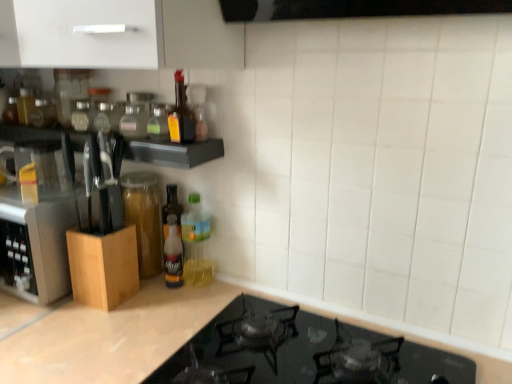
Question: From the image's perspective, is black glass stovetop at lower center located above transparent glass jar at left?

Choices:
 (A) yes
 (B) no

Answer: (B)

Question: Can you confirm if black glass stovetop at lower center is positioned to the left of transparent glass jar at left?

Choices:
 (A) no
 (B) yes

Answer: (A)

Question: Can you confirm if black glass stovetop at lower center is wider than transparent glass jar at left?

Choices:
 (A) no
 (B) yes

Answer: (B)

Question: Is black glass stovetop at lower center closer to camera compared to transparent glass jar at left?

Choices:
 (A) no
 (B) yes

Answer: (B)

Question: Can you confirm if black glass stovetop at lower center is bigger than transparent glass jar at left?

Choices:
 (A) yes
 (B) no

Answer: (A)

Question: Would you say transparent glass jar at left is inside or outside translucent plastic bottle at upper center, the 4th bottle ordered from the bottom?

Choices:
 (A) outside
 (B) inside

Answer: (A)

Question: In the image, is transparent glass jar at left positioned in front of or behind translucent plastic bottle at upper center, the third bottle when ordered from top to bottom?

Choices:
 (A) front
 (B) behind

Answer: (B)

Question: From their relative heights in the image, would you say transparent glass jar at left is taller or shorter than translucent plastic bottle at upper center, the 4th bottle ordered from the bottom?

Choices:
 (A) short
 (B) tall

Answer: (B)

Question: Is transparent glass jar at left bigger or smaller than translucent plastic bottle at upper center, the 4th bottle ordered from the bottom?

Choices:
 (A) big
 (B) small

Answer: (A)

Question: Visually, is translucent glass bottle at center, the first bottle positioned from the bottom, positioned to the left or to the right of transparent glass jar at left?

Choices:
 (A) left
 (B) right

Answer: (B)

Question: In terms of width, does translucent glass bottle at center, which is the sixth bottle in top-to-bottom order, look wider or thinner when compared to transparent glass jar at left?

Choices:
 (A) thin
 (B) wide

Answer: (A)

Question: Is point (179, 281) positioned closer to the camera than point (155, 177)?

Choices:
 (A) farther
 (B) closer

Answer: (B)

Question: From a real-world perspective, relative to transparent glass jar at left, is translucent glass bottle at center, the first bottle positioned from the bottom, vertically above or below?

Choices:
 (A) below
 (B) above

Answer: (A)

Question: Looking at the image, does transparent glass jar at left seem bigger or smaller compared to clear glass bottle at upper center, which is the 6th bottle from bottom to top?

Choices:
 (A) big
 (B) small

Answer: (A)

Question: From a real-world perspective, is transparent glass jar at left positioned above or below clear glass bottle at upper center, the first bottle from the top?

Choices:
 (A) below
 (B) above

Answer: (A)